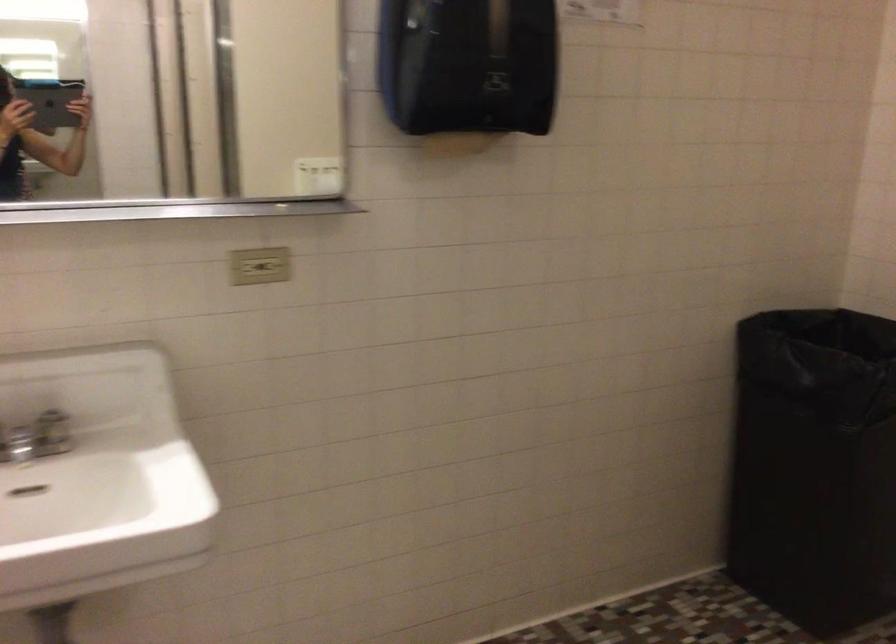
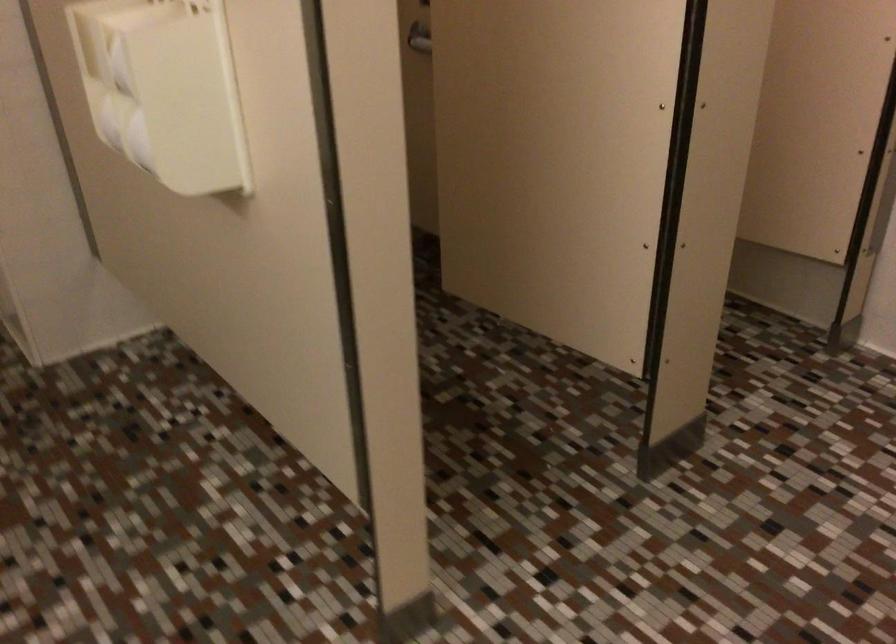
The images are taken continuously from a first-person perspective. In which direction is your viewpoint rotating?

The rotation direction of the camera is right-down.